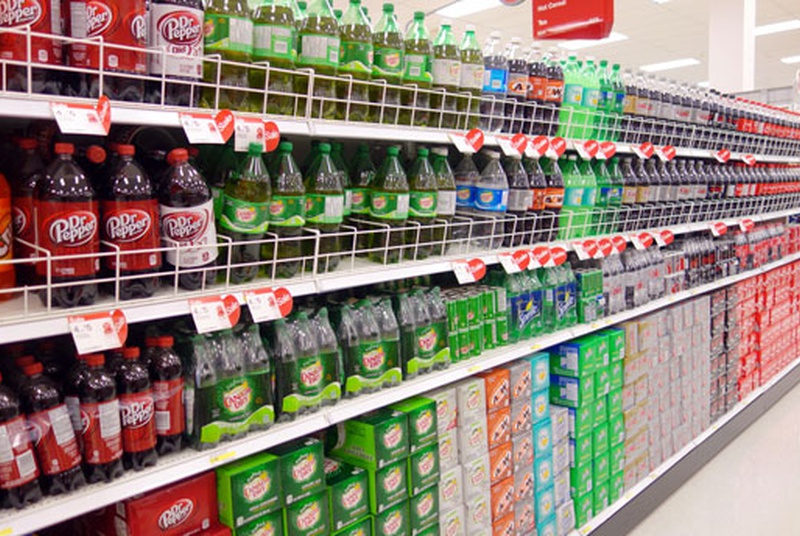
At what (x,y) coordinates should I click in order to perform the action: click on store shelves. Please return your answer as a coordinate pair (x, y). The height and width of the screenshot is (536, 800). Looking at the image, I should click on (366, 134), (358, 281), (426, 379), (622, 497).